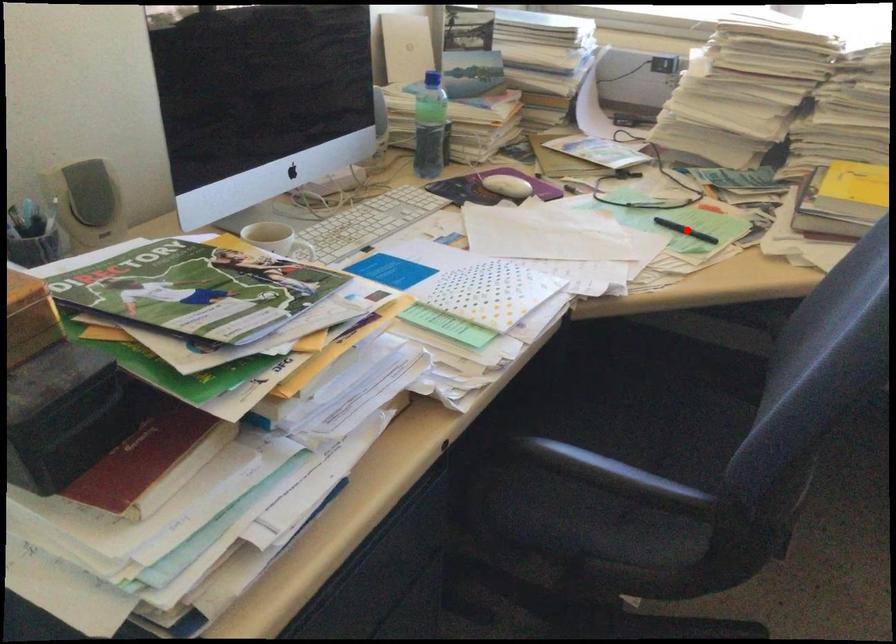
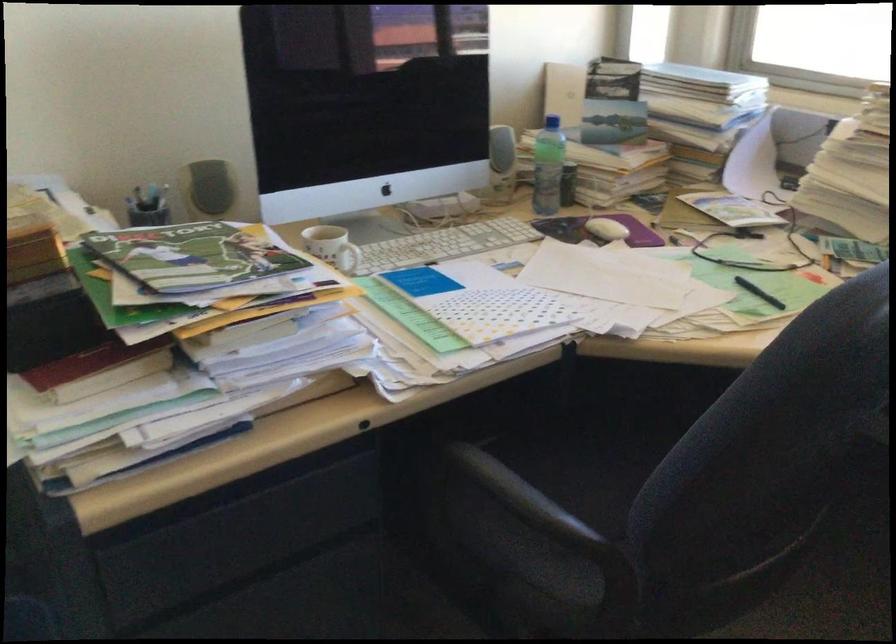
Where in the second image is the point corresponding to the highlighted location from the first image?

(759, 292)